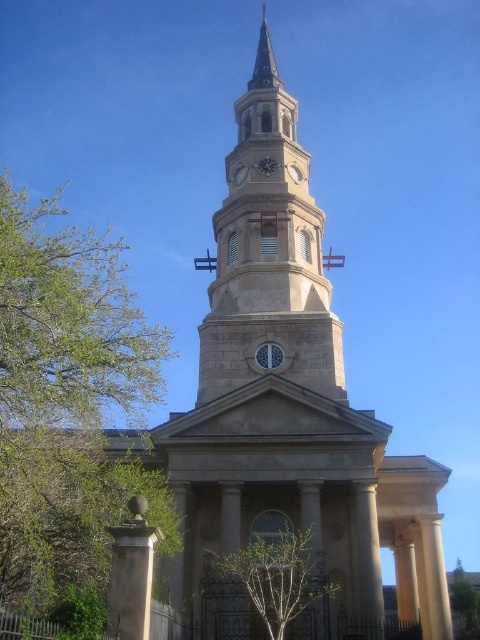
Question: Is green leafy tree at center positioned at the back of black metal clock at upper center?

Choices:
 (A) no
 (B) yes

Answer: (A)

Question: Is green leafy tree at lower right to the right of black metal clock at upper center from the viewer's perspective?

Choices:
 (A) no
 (B) yes

Answer: (B)

Question: Is green leafy tree at left wider than green leafy tree at lower right?

Choices:
 (A) no
 (B) yes

Answer: (B)

Question: Which object is the closest to the light beige stone clock tower at center?

Choices:
 (A) green leafy tree at left
 (B) black metal clock at upper center
 (C) green leafy tree at center

Answer: (B)

Question: Which point is closer to the camera?

Choices:
 (A) green leafy tree at lower right
 (B) green leafy tree at left
 (C) light beige stone clock tower at center

Answer: (B)

Question: Which object appears farthest from the camera in this image?

Choices:
 (A) green leafy tree at center
 (B) green leafy tree at lower right
 (C) light beige stone clock tower at center
 (D) black metal clock at upper center

Answer: (B)